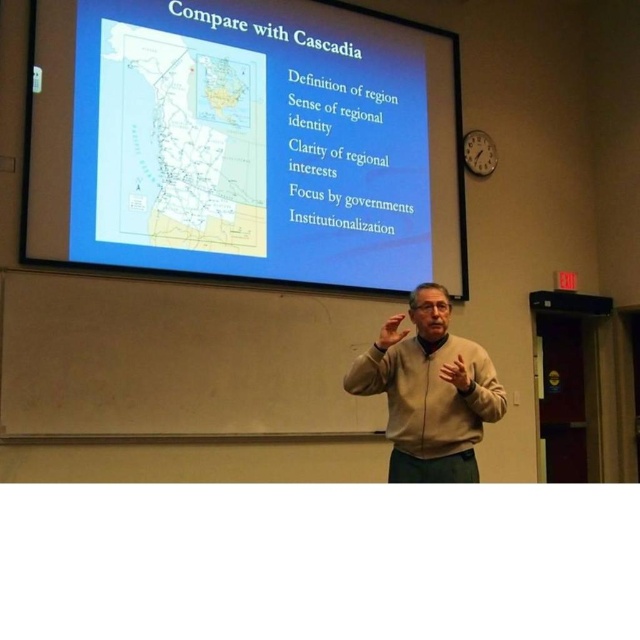
You are an attendee at the presentation and want to know which of the two points, point (426, 99) or point (448, 412), is closer to you in the 3D space of the slide. Which one is closer?

Point (426, 99) is closer to you because it is further to the viewer than point (448, 412).

You are an attendee sitting in the front row of the lecture hall. You notice the beige sweater at center and the white matte projection screen at upper center. Which object is closer to you?

The white matte projection screen at upper center is closer to you because the beige sweater at center is behind it.